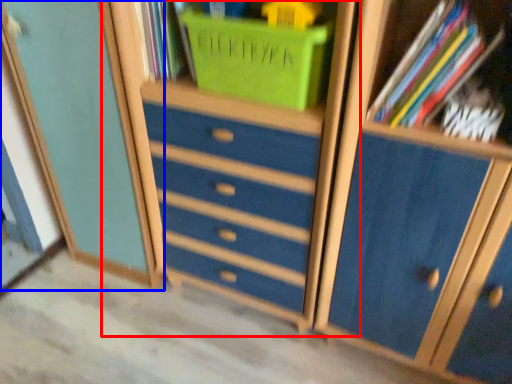
Question: Which point is closer to the camera, dresser (highlighted by a red box) or cupboard (highlighted by a blue box)?

Choices:
 (A) dresser
 (B) cupboard

Answer: (A)